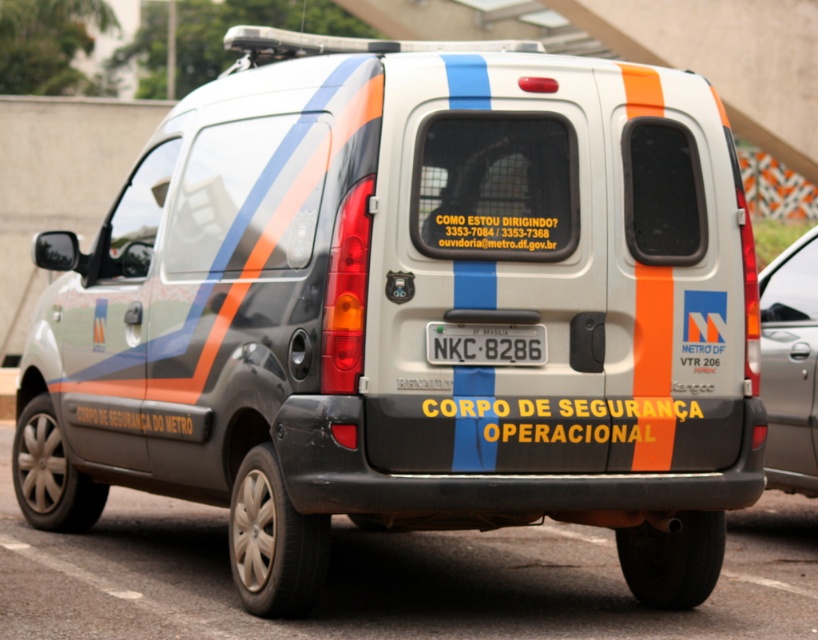
Who is more forward, [808,269] or [522,364]?

Point [522,364]

Who is shorter, metallic gray van at right or white plastic license plate at center?

Standing shorter between the two is white plastic license plate at center.

Which is in front, point (763, 464) or point (484, 323)?

Point (484, 323)

Find the location of a particular element. The image size is (818, 640). metallic gray van at right is located at coordinates (790, 365).